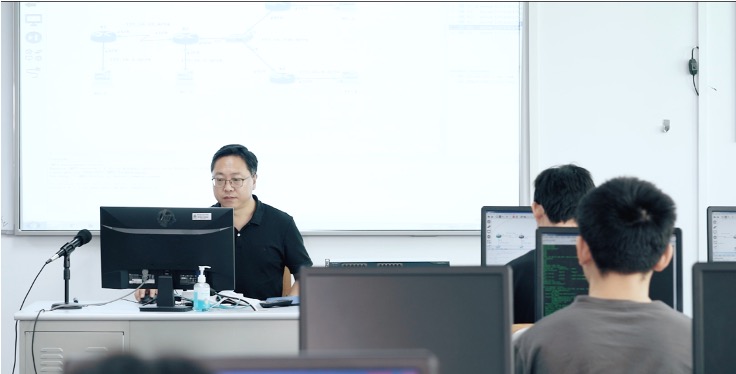
Where is `cord`? cord is located at coordinates (686, 70).